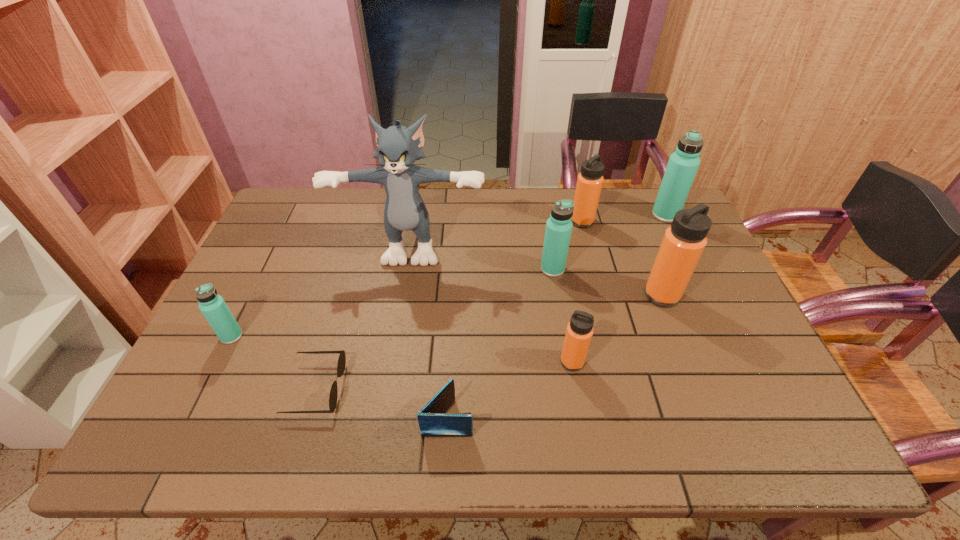
Where is `object located in the left edge section of the desktop`? The image size is (960, 540). object located in the left edge section of the desktop is located at coordinates (213, 307).

This screenshot has height=540, width=960. What are the coordinates of `object located at the far right corner` in the screenshot? It's located at (683, 164).

Identify the location of blank space at the far edge of the desktop. The image size is (960, 540). (328, 210).

In the image, there is a desktop. In order to click on vacant space at the near edge in this screenshot , I will do `click(534, 435)`.

In the image, there is a desktop. At what (x,y) coordinates should I click in order to perform the action: click on vacant space at the left edge. Please return your answer as a coordinate pair (x, y). The width and height of the screenshot is (960, 540). Looking at the image, I should click on click(x=217, y=356).

Locate an element on the screen. This screenshot has height=540, width=960. vacant space at the right edge of the desktop is located at coordinates (703, 291).

Image resolution: width=960 pixels, height=540 pixels. What are the coordinates of `free space between the cat and the farthest orange thermos bottle` in the screenshot? It's located at (497, 232).

Locate an element on the screen. This screenshot has width=960, height=540. free space that is in between the second orange thermos bottle from left to right and the fifth thermos bottle from left to right is located at coordinates (622, 258).

The width and height of the screenshot is (960, 540). In order to click on vacant point located between the sunglasses and the smallest orange thermos bottle in this screenshot , I will do `click(444, 375)`.

You are a GUI agent. You are given a task and a screenshot of the screen. Output one action in this format:
    pyautogui.click(x=<x>, y=<y>)
    Task: Click on the empty space that is in between the tallest object and the rightmost object
    
    Given the screenshot: What is the action you would take?
    pyautogui.click(x=540, y=229)